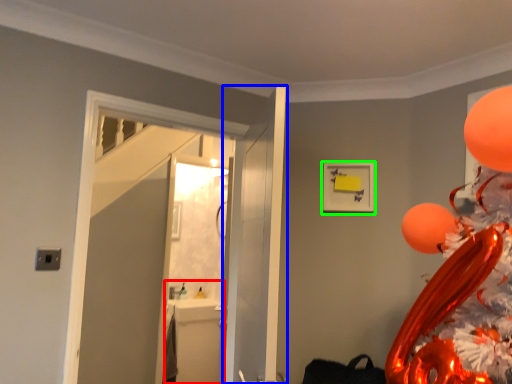
Question: Which object is positioned closest to sink (highlighted by a red box)? Select from door (highlighted by a blue box) and picture frame (highlighted by a green box).

Choices:
 (A) door
 (B) picture frame

Answer: (A)